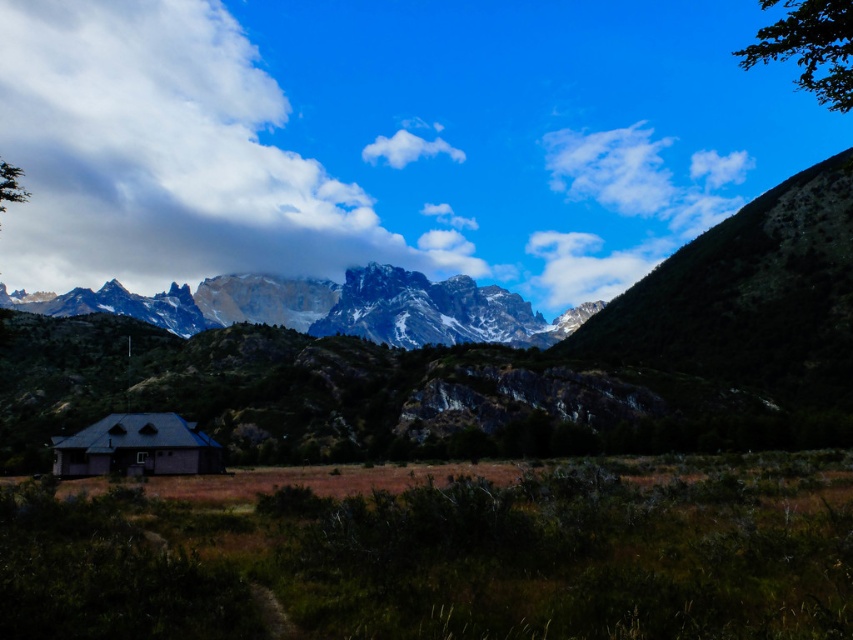
You are an airplane pilot flying over the mountains and notice the green leafy tree at upper right and the white fluffy cloud at upper center in your view. Which object would appear larger to you from your current altitude?

The green leafy tree at upper right appears larger because it is closer to the viewer than the white fluffy cloud at upper center.

You are standing in the landscape scene and want to take a photo of the gray wooden cabin at lower left and the white fluffy cloud at upper center. Can you see both objects clearly in the same frame without any obstruction?

Yes, the gray wooden cabin at lower left is in front of the white fluffy cloud at upper center, but since the cabin is much smaller and positioned lower, the cloud at upper center should remain visible in the frame.

In the scene shown: You are standing at the center of the image and want to head towards the green leafy tree at upper right. Which direction should you move in?

The green leafy tree at upper right is located at point (811, 48), so you should move towards the upper right direction to reach it.